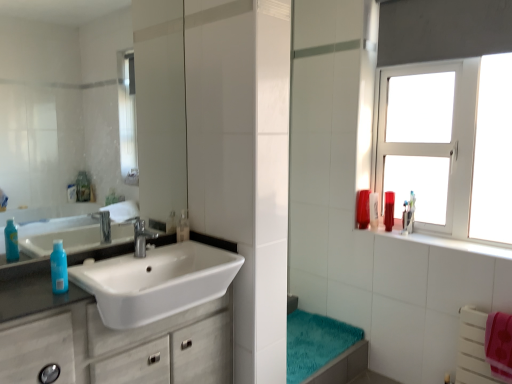
The image size is (512, 384). I want to click on vacant area that lies between translucent plastic mouthwash at sink, the 1th mouthwash viewed from the left, and silver metallic faucet at center, so click(168, 246).